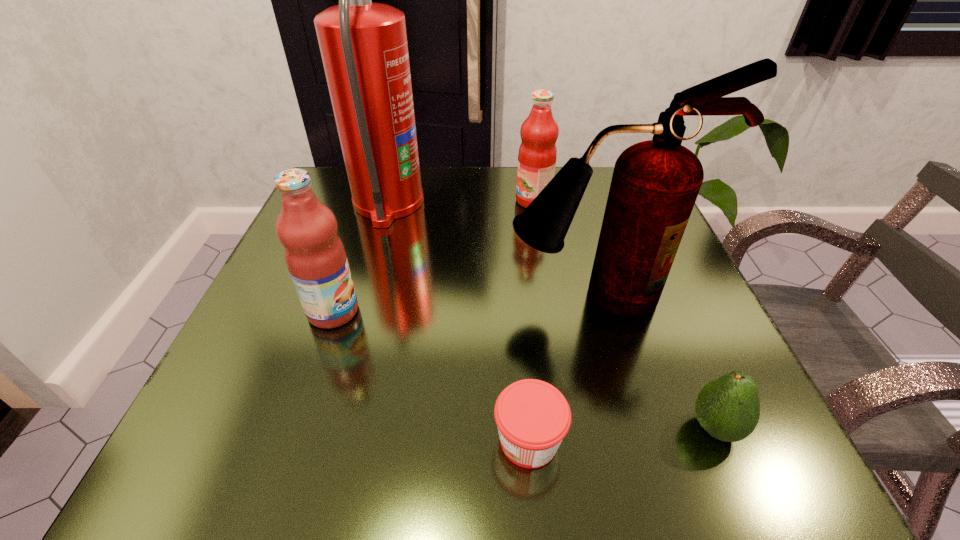
The height and width of the screenshot is (540, 960). In the image, there is a desktop. In order to click on vacant space at the left edge in this screenshot , I will do `click(254, 304)`.

Find the location of a particular element. This screenshot has height=540, width=960. free space at the right edge of the desktop is located at coordinates (690, 396).

You are a GUI agent. You are given a task and a screenshot of the screen. Output one action in this format:
    pyautogui.click(x=<x>, y=<y>)
    Task: Click on the free space at the near left corner
    Image resolution: width=960 pixels, height=540 pixels.
    Given the screenshot: What is the action you would take?
    pyautogui.click(x=194, y=478)

Where is `vacant area that lies between the second shortest object and the nearer fire extinguisher`? vacant area that lies between the second shortest object and the nearer fire extinguisher is located at coordinates (656, 361).

You are a GUI agent. You are given a task and a screenshot of the screen. Output one action in this format:
    pyautogui.click(x=<x>, y=<y>)
    Task: Click on the free space between the shortest object and the left fire extinguisher
    
    Given the screenshot: What is the action you would take?
    pyautogui.click(x=458, y=322)

In order to click on vacant area that lies between the left fire extinguisher and the nearer fruit juice in this screenshot , I will do `click(361, 258)`.

Where is `free spot between the nearer fruit juice and the right fruit juice`? The image size is (960, 540). free spot between the nearer fruit juice and the right fruit juice is located at coordinates (433, 256).

This screenshot has height=540, width=960. I want to click on free space between the nearer fire extinguisher and the nearer fruit juice, so click(x=466, y=303).

Image resolution: width=960 pixels, height=540 pixels. What are the coordinates of `free space between the left fire extinguisher and the right fruit juice` in the screenshot? It's located at (461, 202).

The height and width of the screenshot is (540, 960). Find the location of `blank region between the taller fire extinguisher and the right fire extinguisher`. blank region between the taller fire extinguisher and the right fire extinguisher is located at coordinates (492, 249).